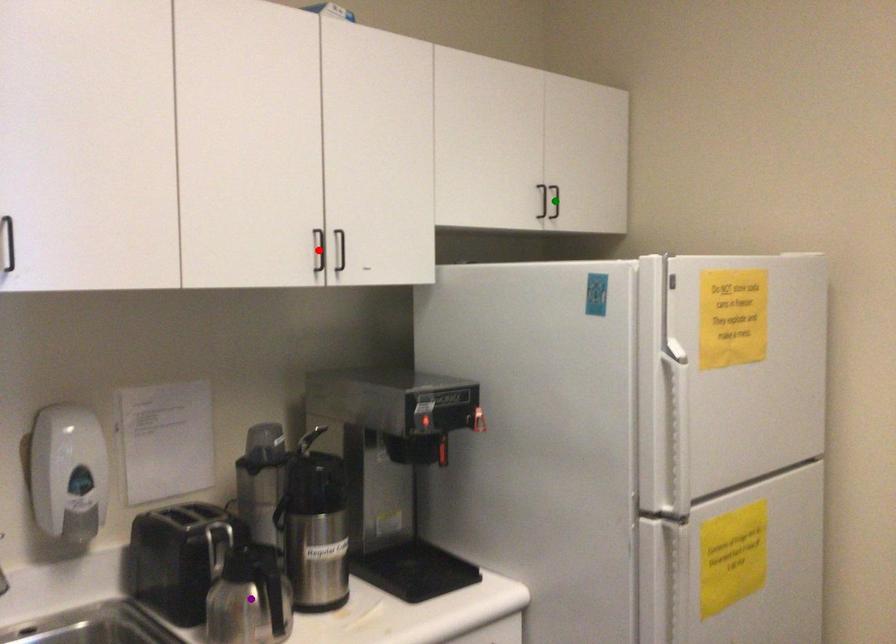
Order these from nearest to farthest:
purple point | red point | green point

purple point < red point < green point